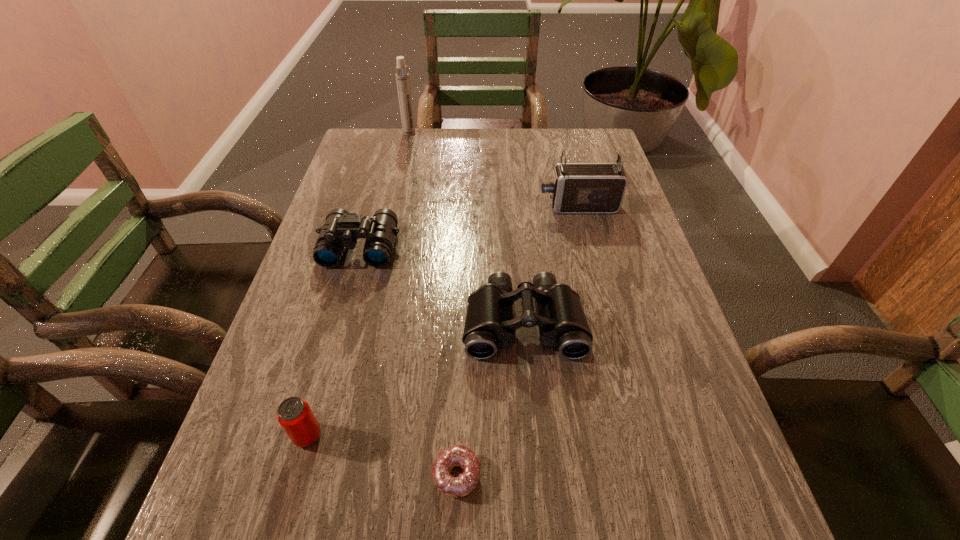
Identify the location of aerosol can. click(402, 77).

Where is `the tallest object`? The width and height of the screenshot is (960, 540). the tallest object is located at coordinates (402, 77).

At what (x,y) coordinates should I click in order to perform the action: click on the fifth shortest object. Please return your answer as a coordinate pair (x, y). The image size is (960, 540). Looking at the image, I should click on coord(577,188).

Locate an element on the screen. the second farthest object is located at coordinates (577, 188).

Where is `the left binoculars`? The width and height of the screenshot is (960, 540). the left binoculars is located at coordinates (341, 229).

I want to click on the farther binoculars, so click(341, 229).

Image resolution: width=960 pixels, height=540 pixels. Identify the location of the nearer binoculars. (489, 324).

Locate an element on the screen. The height and width of the screenshot is (540, 960). the right binoculars is located at coordinates (489, 324).

This screenshot has width=960, height=540. I want to click on can, so click(294, 414).

I want to click on the nearest object, so click(x=456, y=455).